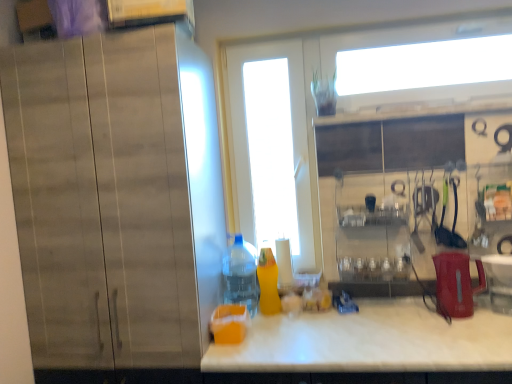
Question: Considering the relative sizes of red plastic kettle at right and white glossy screen door at center in the image provided, is red plastic kettle at right taller than white glossy screen door at center?

Choices:
 (A) yes
 (B) no

Answer: (B)

Question: Is red plastic kettle at right further to camera compared to white glossy screen door at center?

Choices:
 (A) yes
 (B) no

Answer: (B)

Question: Are red plastic kettle at right and white glossy screen door at center beside each other?

Choices:
 (A) yes
 (B) no

Answer: (B)

Question: Can you confirm if red plastic kettle at right is thinner than white glossy screen door at center?

Choices:
 (A) no
 (B) yes

Answer: (A)

Question: Is red plastic kettle at right shorter than white glossy screen door at center?

Choices:
 (A) yes
 (B) no

Answer: (A)

Question: From a real-world perspective, is white glossy screen door at center above or below translucent plastic bottle at center, which is counted as the 1th bottle, starting from the left?

Choices:
 (A) above
 (B) below

Answer: (A)

Question: In the image, is white glossy screen door at center positioned in front of or behind translucent plastic bottle at center, which is counted as the 1th bottle, starting from the left?

Choices:
 (A) front
 (B) behind

Answer: (B)

Question: Looking at their shapes, would you say white glossy screen door at center is wider or thinner than translucent plastic bottle at center, arranged as the 2th bottle when viewed from the right?

Choices:
 (A) thin
 (B) wide

Answer: (A)

Question: Does point (244, 137) appear closer or farther from the camera than point (238, 289)?

Choices:
 (A) closer
 (B) farther

Answer: (B)

Question: Looking at the image, does white marble countertop at center seem bigger or smaller compared to red plastic kettle at right?

Choices:
 (A) big
 (B) small

Answer: (A)

Question: From the image's perspective, relative to red plastic kettle at right, is white marble countertop at center above or below?

Choices:
 (A) above
 (B) below

Answer: (B)

Question: Considering the positions of white marble countertop at center and red plastic kettle at right in the image, is white marble countertop at center taller or shorter than red plastic kettle at right?

Choices:
 (A) short
 (B) tall

Answer: (B)

Question: Relative to red plastic kettle at right, is white marble countertop at center in front or behind?

Choices:
 (A) front
 (B) behind

Answer: (A)

Question: Visually, is matte wood cabinet at left positioned to the left or to the right of white marble countertop at center?

Choices:
 (A) left
 (B) right

Answer: (A)

Question: Considering the positions of matte wood cabinet at left and white marble countertop at center in the image, is matte wood cabinet at left taller or shorter than white marble countertop at center?

Choices:
 (A) short
 (B) tall

Answer: (B)